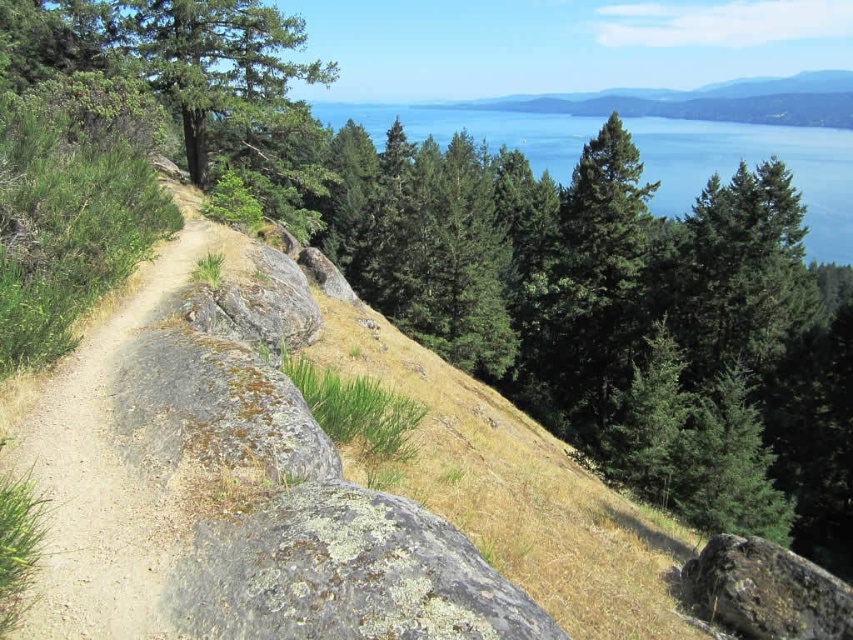
Question: From the image, what is the correct spatial relationship of green leafy grass at center in relation to green grassy at lower left?

Choices:
 (A) below
 (B) above

Answer: (B)

Question: Is dirt path at left below green lichen-covered rock at upper left?

Choices:
 (A) no
 (B) yes

Answer: (B)

Question: Among these points, which one is farthest from the camera?

Choices:
 (A) (3, 628)
 (B) (390, 438)
 (C) (349, 577)

Answer: (B)

Question: Which point appears closest to the camera in this image?

Choices:
 (A) (763, 636)
 (B) (196, 280)
 (C) (175, 387)

Answer: (C)

Question: Can you confirm if lichen-covered rock at center is wider than green mossy rock at center?

Choices:
 (A) no
 (B) yes

Answer: (A)

Question: Which point is farther to the camera?

Choices:
 (A) (103, 451)
 (B) (206, 272)
 (C) (224, 42)
 (D) (328, 452)

Answer: (C)